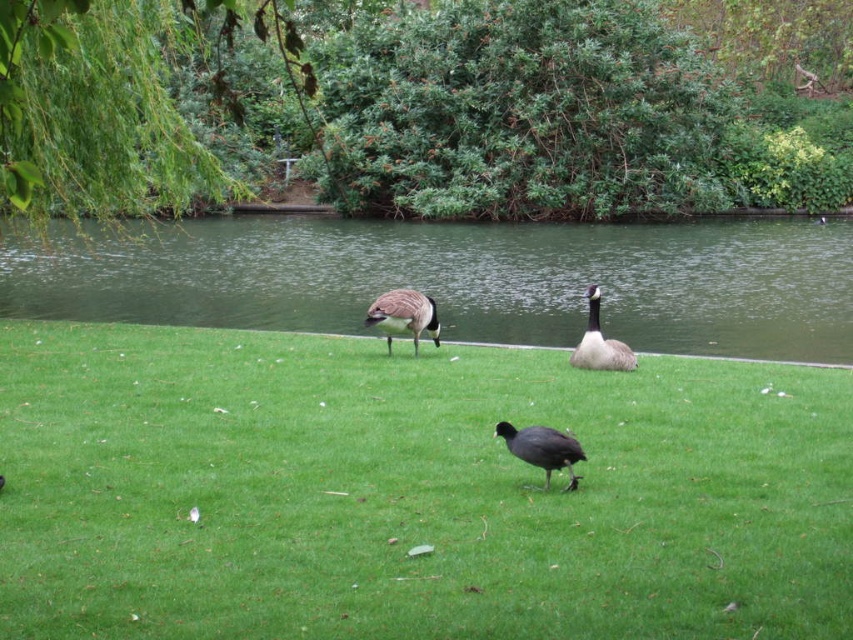
Does green grass at center appear under white downy goose at center?

Correct, green grass at center is located below white downy goose at center.

Between point (94, 410) and point (590, 353), which one is positioned behind?

The point (590, 353) is behind.

The image size is (853, 640). I want to click on green grass at center, so click(x=410, y=492).

Which of these two, green water at center or black matte bird at center, stands shorter?

Standing shorter between the two is black matte bird at center.

Is green water at center below black matte bird at center?

Incorrect, green water at center is not positioned below black matte bird at center.

Which is behind, point (647, 280) or point (521, 444)?

The point (647, 280) is more distant.

Locate an element on the screen. The height and width of the screenshot is (640, 853). green water at center is located at coordinates (x=460, y=280).

Is black matte bird at center to the right of brown speckled feathers at center from the viewer's perspective?

Yes, black matte bird at center is to the right of brown speckled feathers at center.

Between black matte bird at center and brown speckled feathers at center, which one is positioned lower?

black matte bird at center is below.

Measure the distance between black matte bird at center and camera.

black matte bird at center is 7.70 meters from camera.

What are the coordinates of `black matte bird at center` in the screenshot? It's located at (543, 449).